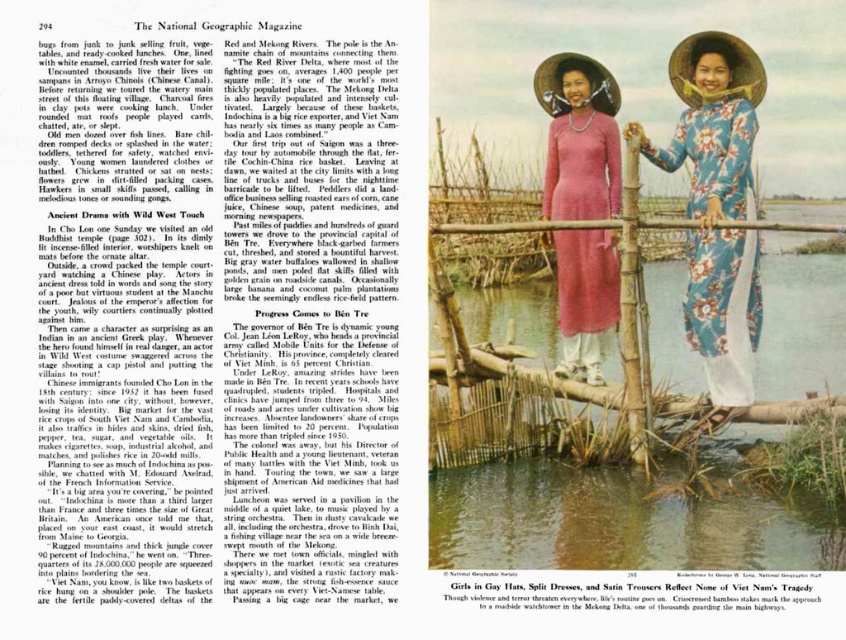
Question: Is floral silk ao dai at center to the right of pink silk dress at center from the viewer's perspective?

Choices:
 (A) yes
 (B) no

Answer: (A)

Question: Does floral silk ao dai at center appear on the right side of pink silk dress at center?

Choices:
 (A) yes
 (B) no

Answer: (A)

Question: From the image, what is the correct spatial relationship of floral silk ao dai at center in relation to pink silk dress at center?

Choices:
 (A) below
 (B) above

Answer: (A)